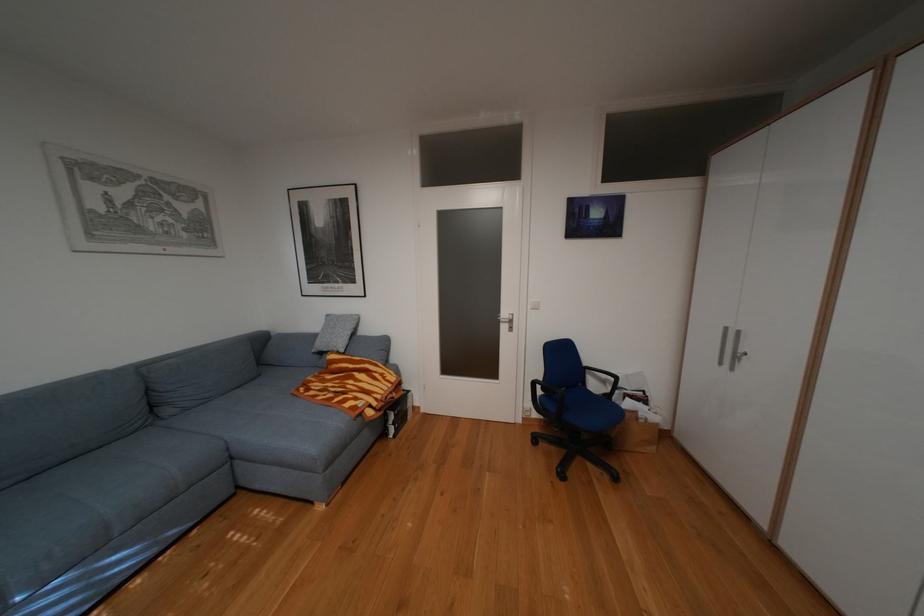
Where is `blue chair sitting surface`? The image size is (924, 616). blue chair sitting surface is located at coordinates (585, 410).